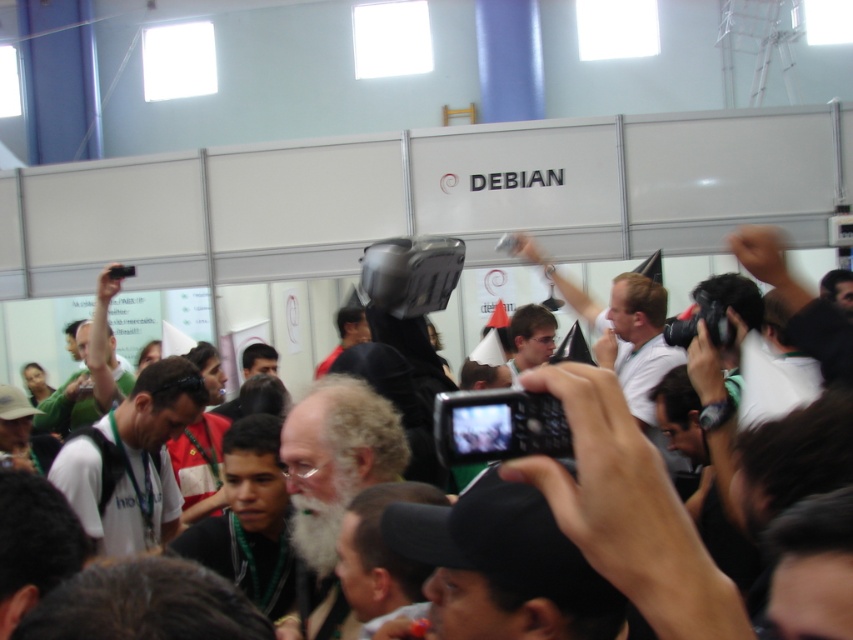
From the picture: You are attending the Debian booth and want to take a photo of the person wearing the white matte shirt at center and the person wearing matte black glasses at center. From your current position, which one should you frame first in your camera viewfinder to ensure both are in the shot?

The white matte shirt at center is positioned on the left side of matte black glasses at center, so you should frame the white matte shirt at center first on the left to include both in the shot.

You are a photographer at the event and want to capture both the white matte shirt at center and the green fabric shirt at center in the same frame. Based on their positions, which shirt should you focus on first to ensure both are in focus?

The white matte shirt at center is below the green fabric shirt at center, so you should focus on the green fabric shirt at center first to ensure both are in focus since it is higher in the frame.

You are standing at the entrance of the event hall and see the point labeled as point [132,460] in the image. What object is located at that point?

The point [132,460] indicates the location of the white matte shirt at center.